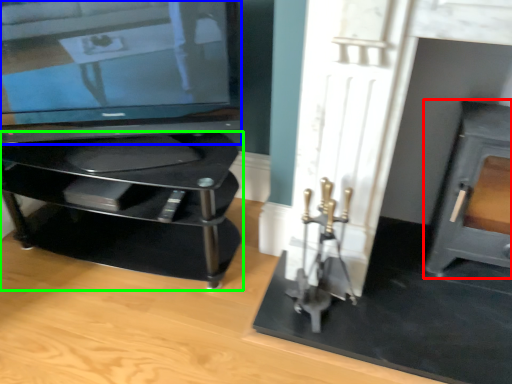
Question: Considering the real-world distances, which object is closest to fireplace (highlighted by a red box)? television (highlighted by a blue box) or furniture (highlighted by a green box).

Choices:
 (A) television
 (B) furniture

Answer: (B)